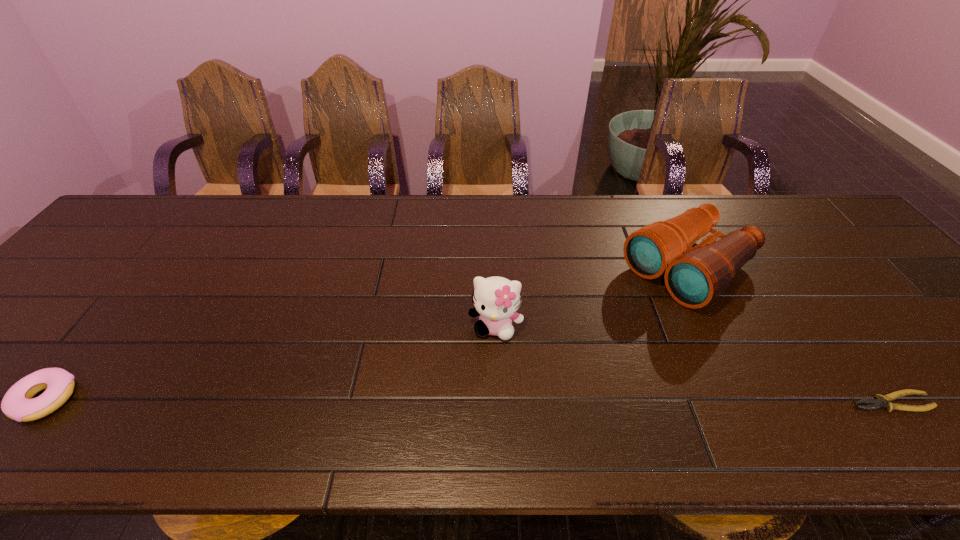
What are the coordinates of `free space on the desktop that is between the doughnut and the shortest object and is positioned on the front-facing side of the kitten` in the screenshot? It's located at (482, 401).

This screenshot has height=540, width=960. In order to click on vacant space on the desktop that is between the leftmost object and the pliers and is positioned through the lenses of the binoculars in this screenshot , I will do (501, 401).